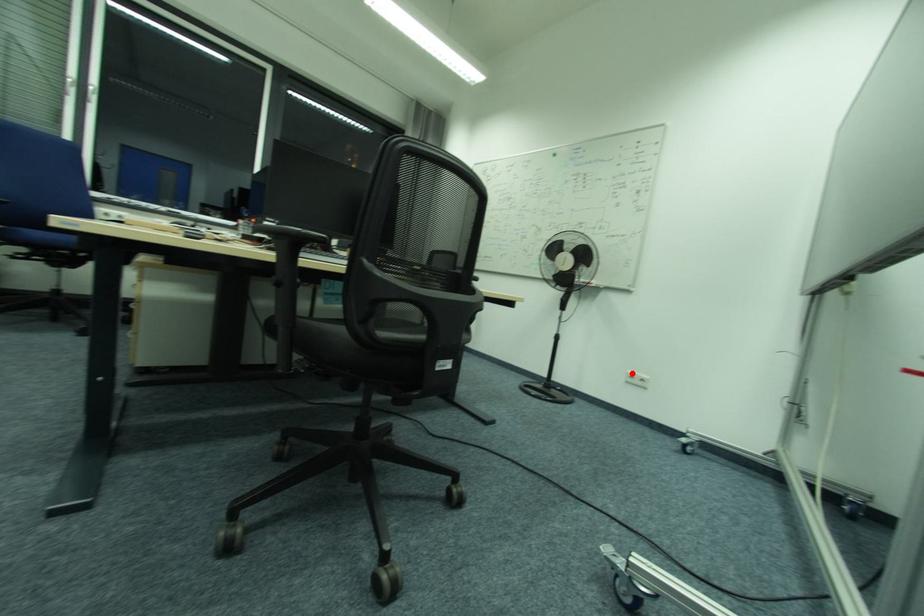
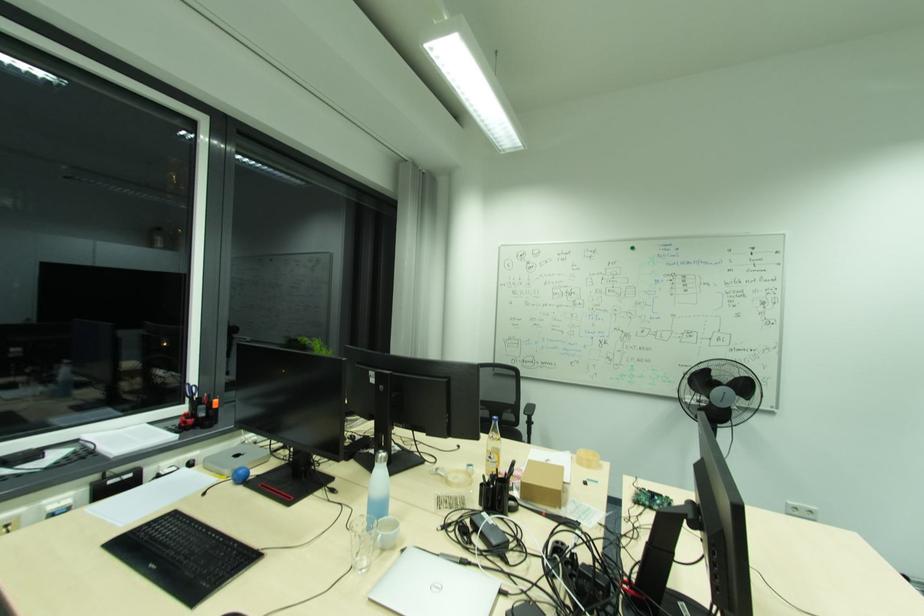
Question: I am providing you with two images of the same scene from different viewpoints. A red point is shown in image1. For the corresponding object point in image2, is it positioned nearer or farther from the camera?

Choices:
 (A) Nearer
 (B) Farther

Answer: (B)